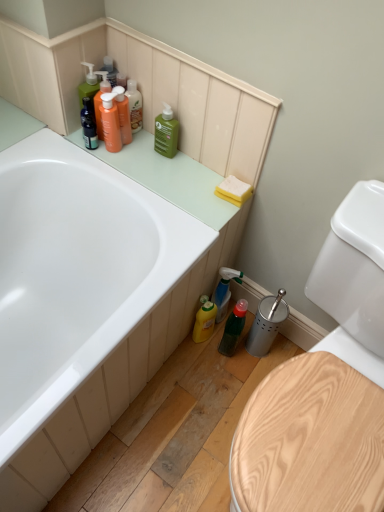
The width and height of the screenshot is (384, 512). I want to click on free location to the right of green matte bottle at upper center, which ranks as the third cleaning product in right-to-left order, so click(x=202, y=167).